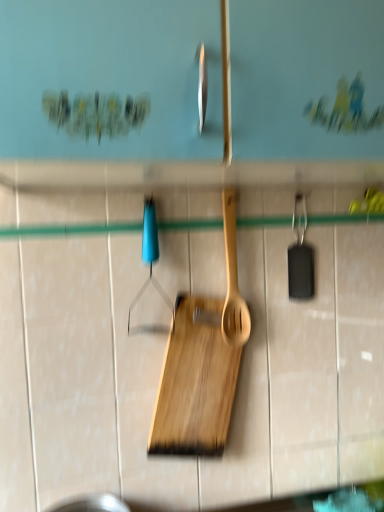
Question: Is wooden spatula at center bigger than blue plastic hanger at center?

Choices:
 (A) yes
 (B) no

Answer: (B)

Question: Is blue plastic hanger at center at the back of wooden spatula at center?

Choices:
 (A) no
 (B) yes

Answer: (A)

Question: From a real-world perspective, does wooden spatula at center sit lower than blue plastic hanger at center?

Choices:
 (A) no
 (B) yes

Answer: (B)

Question: From a real-world perspective, is wooden spatula at center on top of blue plastic hanger at center?

Choices:
 (A) no
 (B) yes

Answer: (A)

Question: Is wooden spatula at center shorter than blue plastic hanger at center?

Choices:
 (A) no
 (B) yes

Answer: (A)

Question: Is natural wood cutting board at center taller or shorter than blue plastic hanger at center?

Choices:
 (A) short
 (B) tall

Answer: (B)

Question: Considering the positions of natural wood cutting board at center and blue plastic hanger at center in the image, is natural wood cutting board at center bigger or smaller than blue plastic hanger at center?

Choices:
 (A) small
 (B) big

Answer: (B)

Question: In terms of width, does natural wood cutting board at center look wider or thinner when compared to blue plastic hanger at center?

Choices:
 (A) thin
 (B) wide

Answer: (B)

Question: From a real-world perspective, is natural wood cutting board at center above or below blue plastic hanger at center?

Choices:
 (A) above
 (B) below

Answer: (B)

Question: From a real-world perspective, is natural wood cutting board at center positioned above or below wooden spatula at center?

Choices:
 (A) below
 (B) above

Answer: (A)

Question: Is natural wood cutting board at center taller or shorter than wooden spatula at center?

Choices:
 (A) tall
 (B) short

Answer: (A)

Question: Considering their positions, is natural wood cutting board at center located in front of or behind wooden spatula at center?

Choices:
 (A) front
 (B) behind

Answer: (A)

Question: Would you say natural wood cutting board at center is to the left or to the right of wooden spatula at center in the picture?

Choices:
 (A) right
 (B) left

Answer: (B)

Question: From a real-world perspective, is wooden spatula at center physically located above or below blue plastic hanger at center?

Choices:
 (A) below
 (B) above

Answer: (A)

Question: In terms of size, does wooden spatula at center appear bigger or smaller than blue plastic hanger at center?

Choices:
 (A) small
 (B) big

Answer: (A)